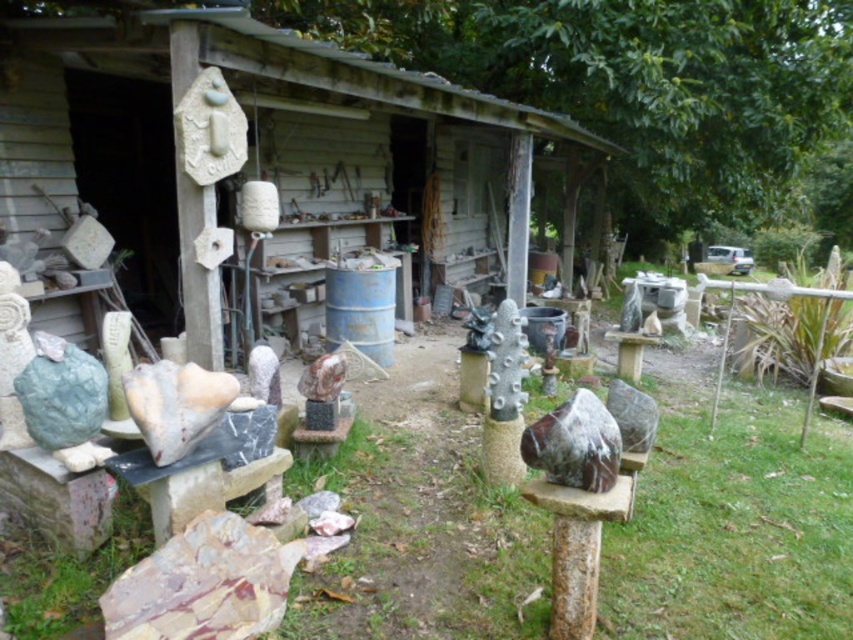
Question: Can you confirm if rustic wood hut at center is positioned to the left of marble sculpture at center?

Choices:
 (A) no
 (B) yes

Answer: (B)

Question: Can you confirm if rustic wood hut at center is thinner than marble sculpture at center?

Choices:
 (A) yes
 (B) no

Answer: (A)

Question: From the image, what is the correct spatial relationship of rustic wood hut at center in relation to marble sculpture at center?

Choices:
 (A) below
 (B) above

Answer: (B)

Question: Which object is closer to the camera taking this photo?

Choices:
 (A) rustic wood hut at center
 (B) marble sculpture at center

Answer: (B)